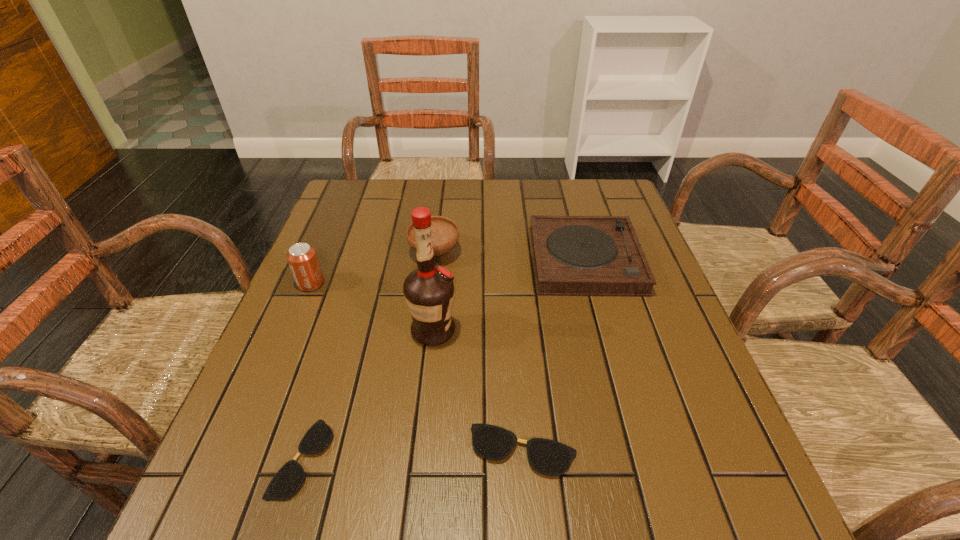
Locate an element on the screen. Image resolution: width=960 pixels, height=540 pixels. unoccupied area between the bowl and the third shortest object is located at coordinates (510, 256).

Where is `blank region between the fourth tallest object and the second shortest object`? This screenshot has width=960, height=540. blank region between the fourth tallest object and the second shortest object is located at coordinates (554, 355).

This screenshot has width=960, height=540. I want to click on blank region between the phonograph record and the liquor, so click(x=509, y=295).

Where is `free spot between the right spectacles and the phonograph record`? This screenshot has height=540, width=960. free spot between the right spectacles and the phonograph record is located at coordinates (554, 355).

This screenshot has height=540, width=960. In order to click on free space that is in between the third shortest object and the shortest object in this screenshot , I will do `click(444, 359)`.

Identify the location of object that stands as the fourth closest to the shortest object. (444, 232).

What are the coordinates of `object that is the fourth nearest to the fifth object from right to left` in the screenshot? It's located at (444, 232).

Locate an element on the screen. vacant space that satisfies the following two spatial constraints: 1. on the front side of the third tallest object; 2. on the left side of the taller spectacles is located at coordinates (410, 450).